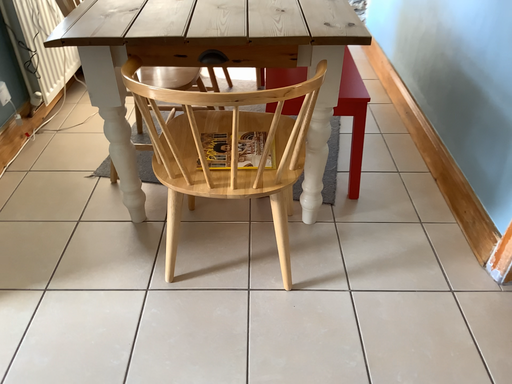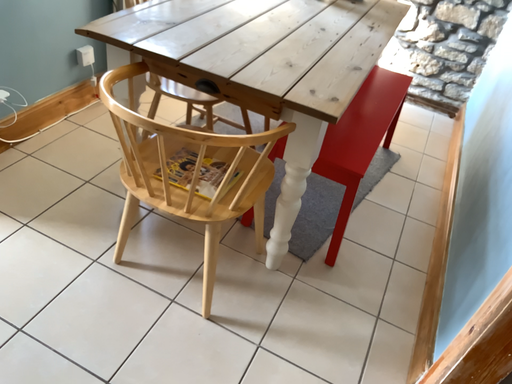
Question: How did the camera likely rotate when shooting the video?

Choices:
 (A) rotated left
 (B) rotated right

Answer: (A)